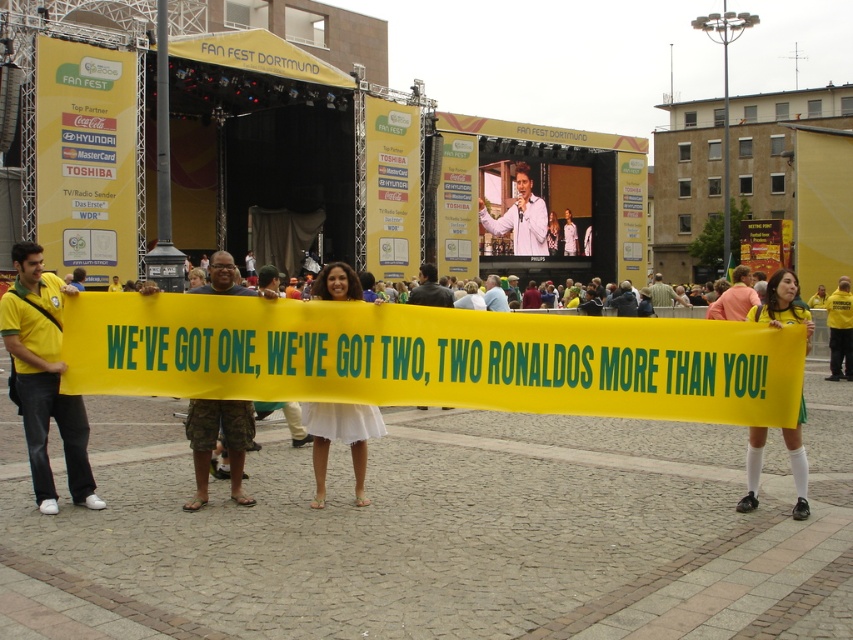
Who is lower down, yellow jersey at left or yellow shirt at center?

yellow jersey at left

Is the position of yellow jersey at left more distant than that of yellow shirt at center?

That is False.

Who is more forward, (42, 298) or (843, 348)?

Point (42, 298) is more forward.

You are a GUI agent. You are given a task and a screenshot of the screen. Output one action in this format:
    pyautogui.click(x=<x>, y=<y>)
    Task: Click on the yellow jersey at left
    Image resolution: width=853 pixels, height=640 pixels.
    Given the screenshot: What is the action you would take?
    pyautogui.click(x=44, y=378)

Who is positioned more to the right, yellow fabric banner at center or yellow shirt at center?

From the viewer's perspective, yellow shirt at center appears more on the right side.

You are a GUI agent. You are given a task and a screenshot of the screen. Output one action in this format:
    pyautogui.click(x=<x>, y=<y>)
    Task: Click on the yellow fabric banner at center
    The height and width of the screenshot is (640, 853).
    Given the screenshot: What is the action you would take?
    (432, 356)

Which is more to the left, white fabric dress at center or white shirt at center?

From the viewer's perspective, white fabric dress at center appears more on the left side.

Is white fabric dress at center thinner than white shirt at center?

Correct, white fabric dress at center's width is less than white shirt at center's.

Where is `white fabric dress at center`? Image resolution: width=853 pixels, height=640 pixels. white fabric dress at center is located at coordinates (341, 440).